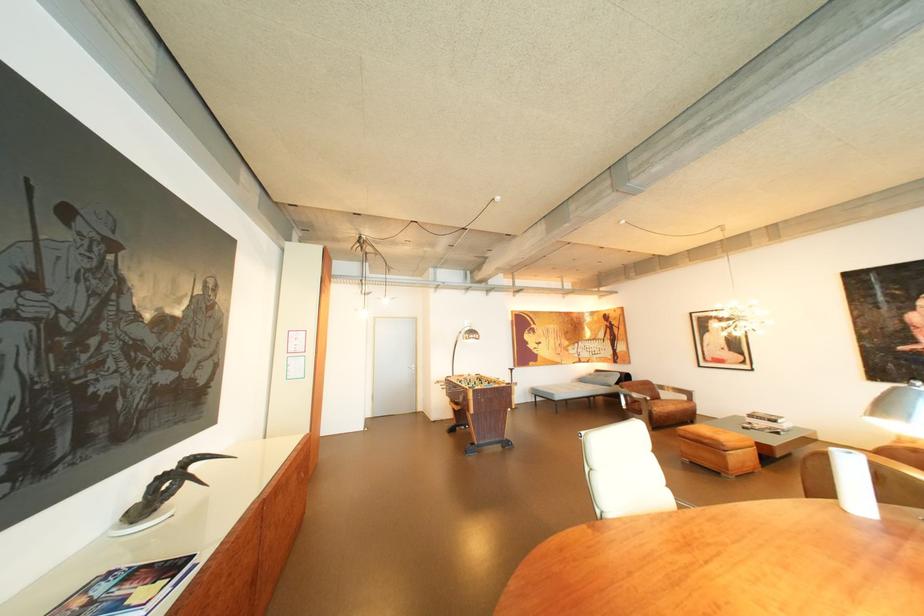
What do you see at coordinates (665, 403) in the screenshot? This screenshot has width=924, height=616. I see `the brown chair sitting surface` at bounding box center [665, 403].